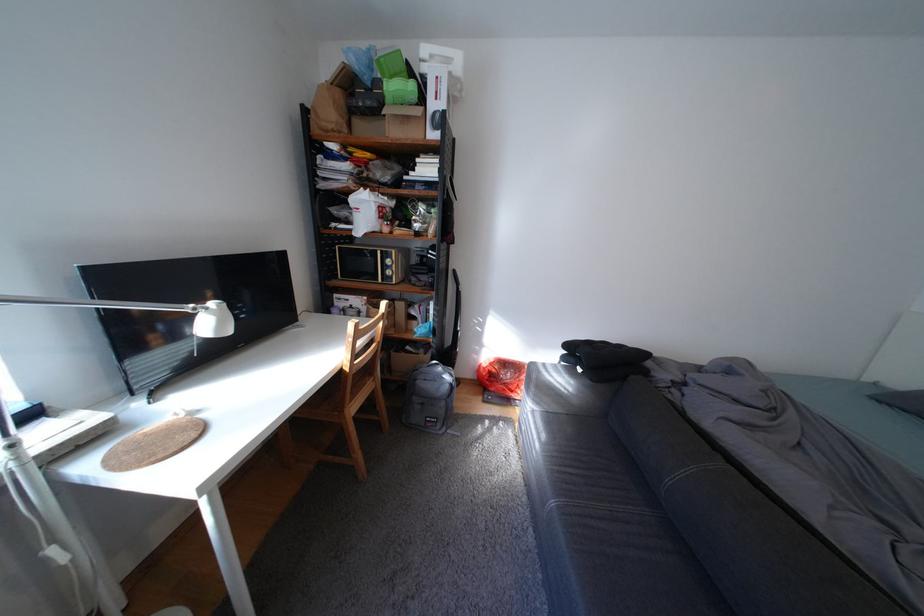
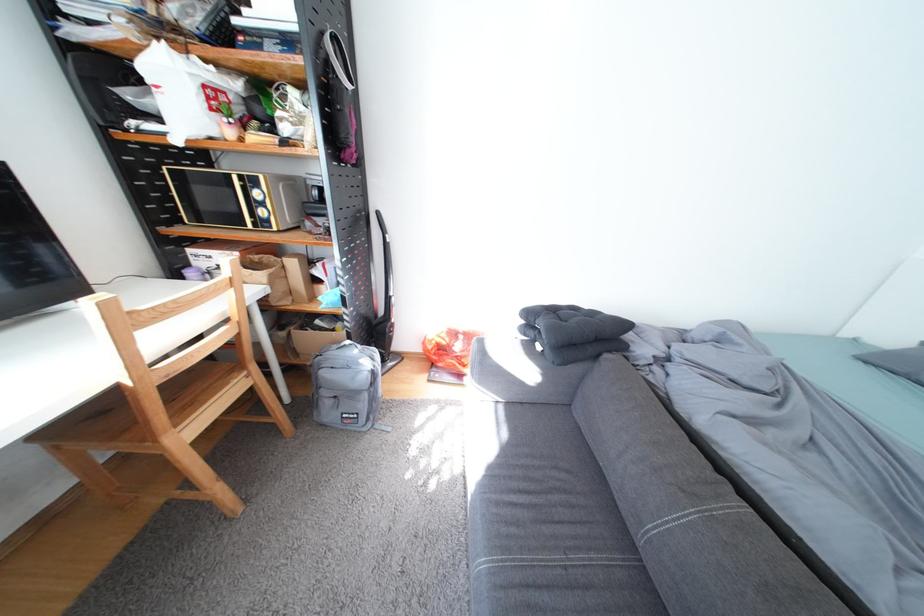
Locate, in the second image, the point that corresponds to the point at 592,371 in the first image.

(552, 347)